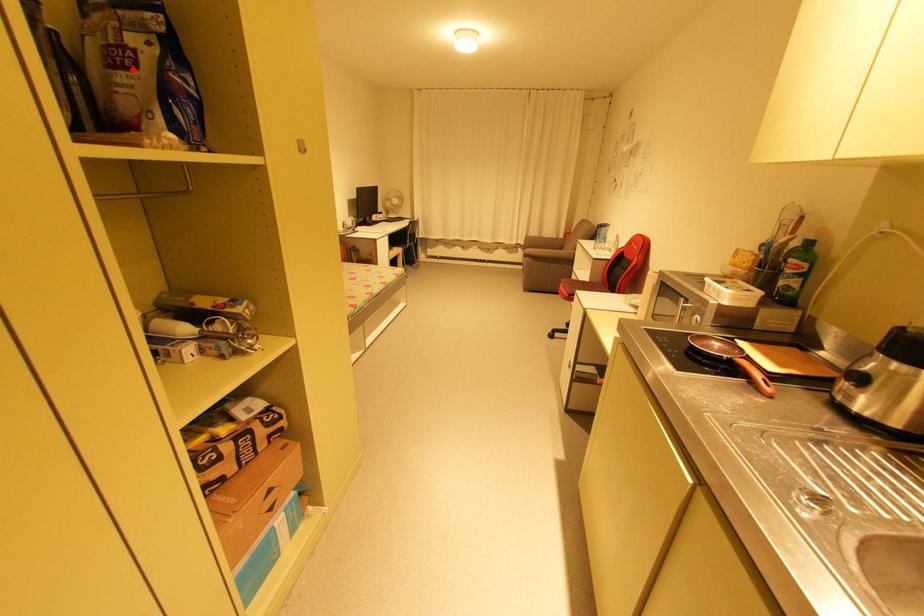
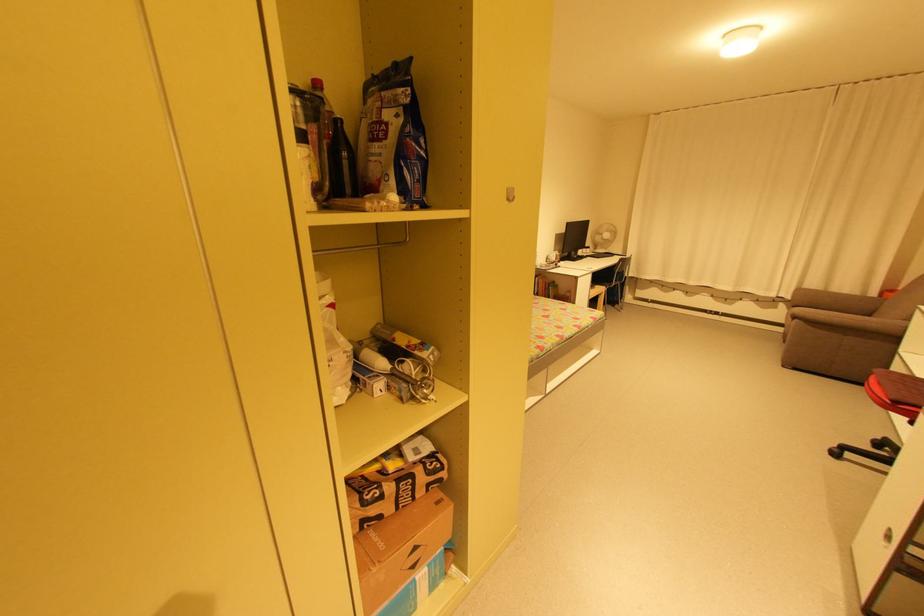
Where in the second image is the point corresponding to the highlighted location from the first image?

(383, 140)